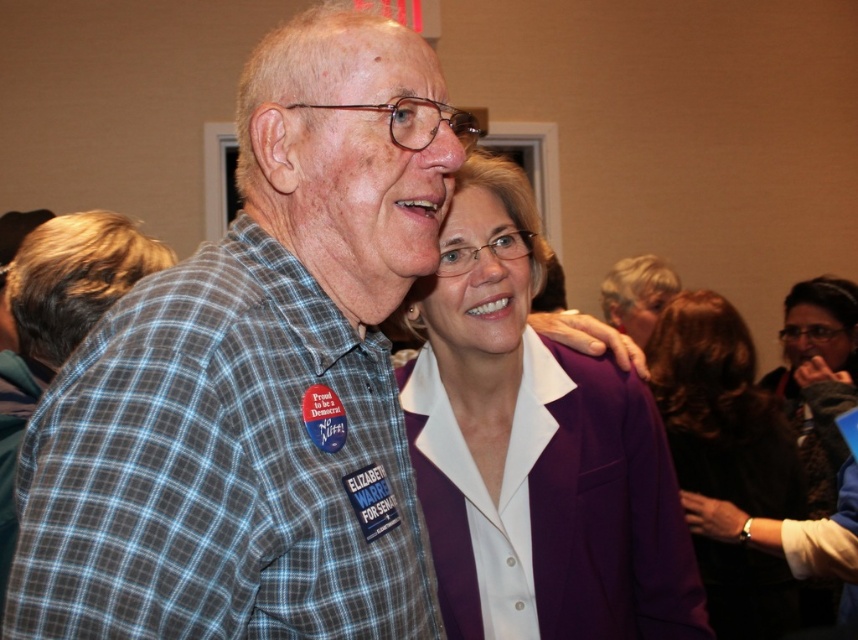
You are standing in front of the image and want to know how far the point at coordinates point (328, 502) is from you. Can you determine the distance?

The point at coordinates point (328, 502) is 28.58 inches from the viewer.

Where is the plaid shirt at center located in the image?

The plaid shirt at center is located at point (257, 380) in the image.

You are a photographer at the event and want to focus your camera on the blue plaid shirt at center and the purple fabric jacket at upper center. Which object should you adjust the focus for first if you want to capture both in sharp detail?

The blue plaid shirt at center is closer to the viewer than the purple fabric jacket at upper center. To capture both in sharp detail, you should adjust the focus starting with the blue plaid shirt at center first since it is closer, then ensure the purple fabric jacket at upper center is within the depth of field.